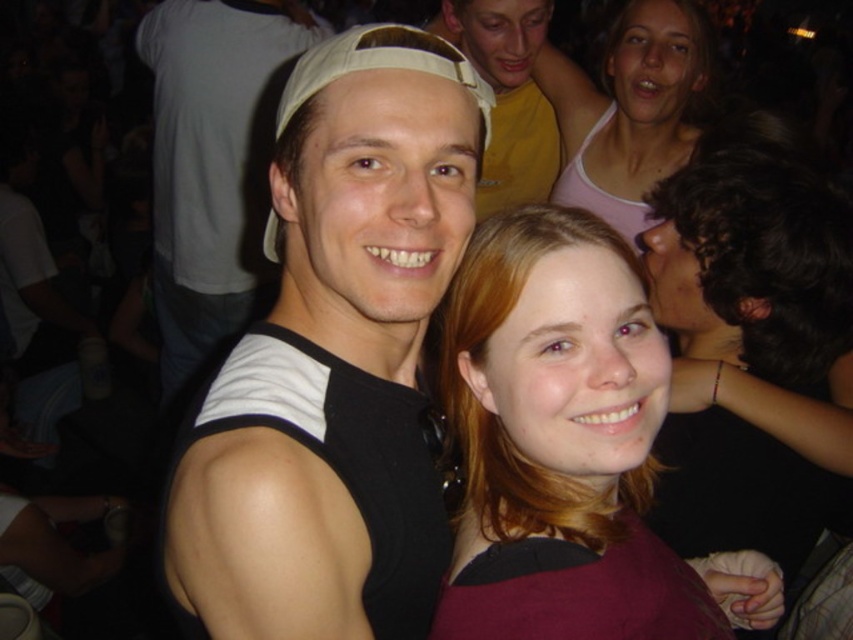
Question: Can you confirm if white fabric cap at center is thinner than pink cotton tank top at upper right?

Choices:
 (A) no
 (B) yes

Answer: (A)

Question: Is black matte tank top at center to the left of white fabric cap at center from the viewer's perspective?

Choices:
 (A) no
 (B) yes

Answer: (A)

Question: Among these objects, which one is nearest to the camera?

Choices:
 (A) black matte tank top at center
 (B) pink cotton tank top at upper right
 (C) yellow matte shirt at upper center
 (D) white fabric cap at center

Answer: (A)

Question: Which point appears closest to the camera in this image?

Choices:
 (A) (547, 161)
 (B) (775, 371)
 (C) (514, 394)
 (D) (219, 220)

Answer: (C)

Question: Which of the following is the closest to the observer?

Choices:
 (A) blonde hair at center
 (B) white fabric cap at center
 (C) yellow matte shirt at upper center

Answer: (A)

Question: Does black matte tank top at center have a smaller size compared to pink cotton tank top at upper right?

Choices:
 (A) yes
 (B) no

Answer: (A)